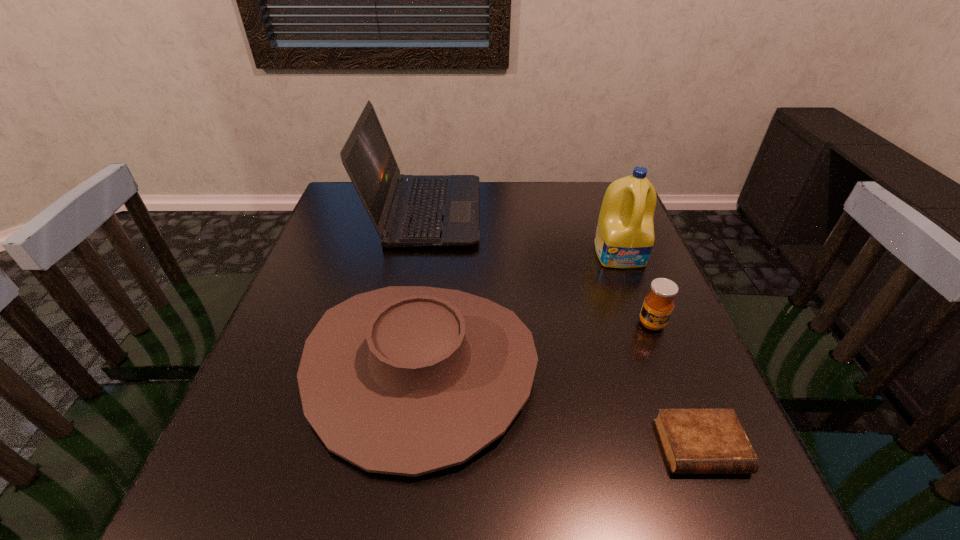
Identify the location of laptop_computer. (406, 210).

You are a GUI agent. You are given a task and a screenshot of the screen. Output one action in this format:
    pyautogui.click(x=<x>, y=<y>)
    Task: Click on the detergent
    The height and width of the screenshot is (540, 960).
    Given the screenshot: What is the action you would take?
    pyautogui.click(x=624, y=238)

You are a GUI agent. You are given a task and a screenshot of the screen. Output one action in this format:
    pyautogui.click(x=<x>, y=<y>)
    Task: Click on the cowboy hat
    The height and width of the screenshot is (540, 960).
    Given the screenshot: What is the action you would take?
    pyautogui.click(x=404, y=380)

Find the location of a particular element. This screenshot has height=540, width=960. honey is located at coordinates (658, 304).

The height and width of the screenshot is (540, 960). Identify the location of the shortest object. (695, 441).

Locate an element on the screen. vacant region located 0.060m on the screen of the laptop_computer is located at coordinates (500, 212).

Where is `vacant space positioned 0.190m on the label of the detergent`? This screenshot has height=540, width=960. vacant space positioned 0.190m on the label of the detergent is located at coordinates (648, 326).

Where is `vacant area located on the right of the cowboy hat`? The width and height of the screenshot is (960, 540). vacant area located on the right of the cowboy hat is located at coordinates (580, 367).

The image size is (960, 540). What are the coordinates of `vacant area situated on the front-facing side of the honey` in the screenshot? It's located at (709, 468).

At what (x,y) coordinates should I click in order to perform the action: click on vacant space located 0.080m on the spine side of the diary. Please return your answer as a coordinate pair (x, y). This screenshot has width=960, height=540. Looking at the image, I should click on click(x=734, y=531).